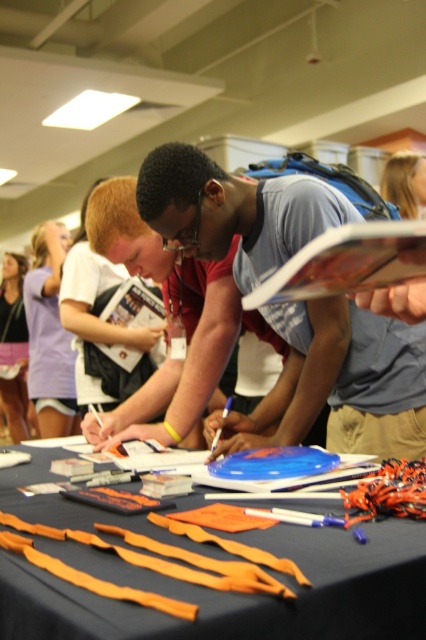
Question: Which point is closer to the camera?

Choices:
 (A) (149, 536)
 (B) (284, 260)

Answer: (A)

Question: Is matte blue shirt at center below orange fabric strips at lower center?

Choices:
 (A) no
 (B) yes

Answer: (A)

Question: In this image, where is matte blue shirt at center located relative to orange fabric strips at lower center?

Choices:
 (A) below
 (B) above

Answer: (B)

Question: Which of the following is the closest to the observer?

Choices:
 (A) (183, 540)
 (B) (342, 396)

Answer: (A)

Question: Where is matte blue shirt at center located in relation to orange fabric strips at lower center in the image?

Choices:
 (A) left
 (B) right

Answer: (B)

Question: Among these objects, which one is farthest from the camera?

Choices:
 (A) matte blue shirt at center
 (B) orange fabric strips at lower center

Answer: (A)